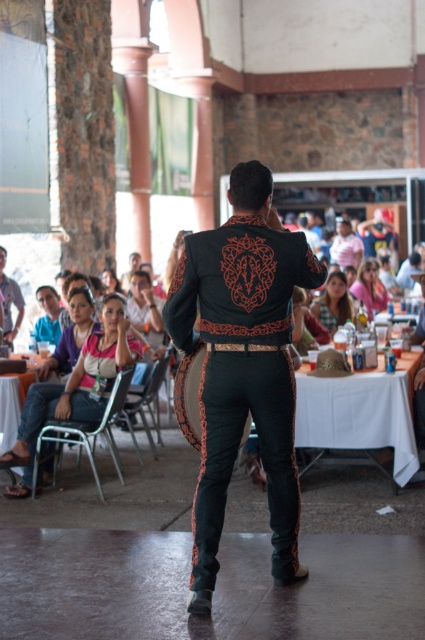
You are a photographer positioned at the entrance of the hall. You need to capture a photo that includes both the black leather mariachi outfit at center and the metallic gray chair at lower left. Based on their positions, which object should be placed on the right side of the photo frame to ensure both are included?

The black leather mariachi outfit at center should be placed on the right side of the photo frame since it is to the right of the metallic gray chair at lower left. This arrangement will ensure both objects are included in the frame.

You are a photographer at the event and want to ensure both the denim jeans at lower left and the matte black dress at center are visible in your photo. Given their height difference, which one might appear larger in the photo?

The denim jeans at lower left is much taller than the matte black dress at center, so it will appear larger in the photo.

You are a photographer setting up a tripod in the middle of the hall. You need to ensure that the black leather mariachi outfit at center and the metallic gray chair at lower left are both visible in your shot. Based on their heights, which object will appear taller in the photo?

The black leather mariachi outfit at center will appear taller in the photo because it has a greater height compared to the metallic gray chair at lower left.